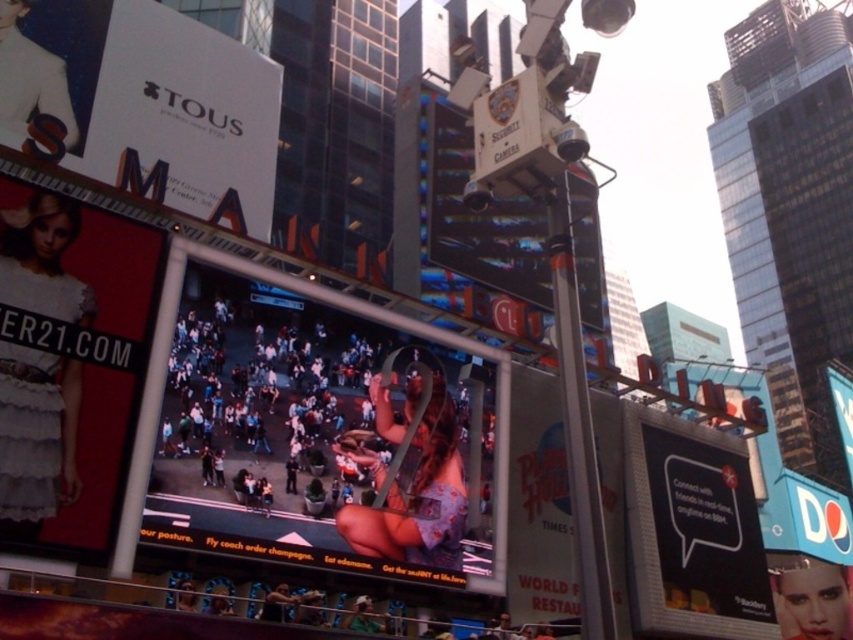
Can you confirm if white glossy sign at upper left is bigger than white glossy signboard at center?

Correct, white glossy sign at upper left is larger in size than white glossy signboard at center.

Between point (102, 19) and point (538, 388), which one is positioned in front?

Point (102, 19) is more forward.

Is point (181, 54) positioned before point (521, 397)?

No, (181, 54) is further to viewer.

What are the coordinates of `white glossy sign at upper left` in the screenshot? It's located at (143, 104).

The width and height of the screenshot is (853, 640). Describe the element at coordinates (143, 104) in the screenshot. I see `white glossy sign at upper left` at that location.

Which is more to the left, white glossy sign at upper left or metallic security camera at upper center?

white glossy sign at upper left is more to the left.

Does point (134, 122) lie in front of point (508, 216)?

Yes, it is in front of point (508, 216).

Find the location of a particular element. This screenshot has height=640, width=853. white glossy sign at upper left is located at coordinates (143, 104).

Can you confirm if black matte billboard at right is shorter than metallic security camera at upper center?

Yes, black matte billboard at right is shorter than metallic security camera at upper center.

Is black matte billboard at right to the right of metallic security camera at upper center from the viewer's perspective?

Correct, you'll find black matte billboard at right to the right of metallic security camera at upper center.

The width and height of the screenshot is (853, 640). Describe the element at coordinates (692, 531) in the screenshot. I see `black matte billboard at right` at that location.

The width and height of the screenshot is (853, 640). Identify the location of black matte billboard at right. (692, 531).